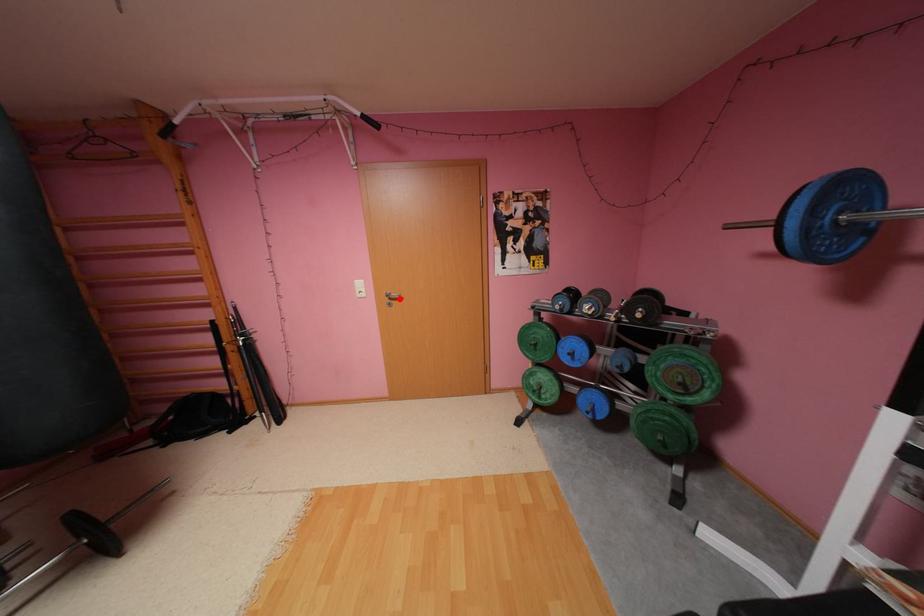
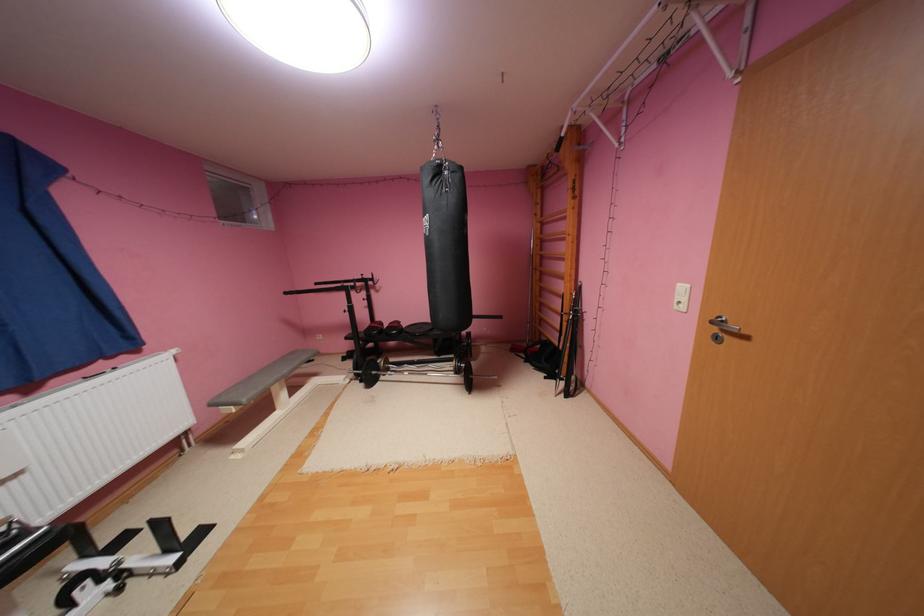
In the second image, find the point that corresponds to the highlighted location in the first image.

(733, 330)